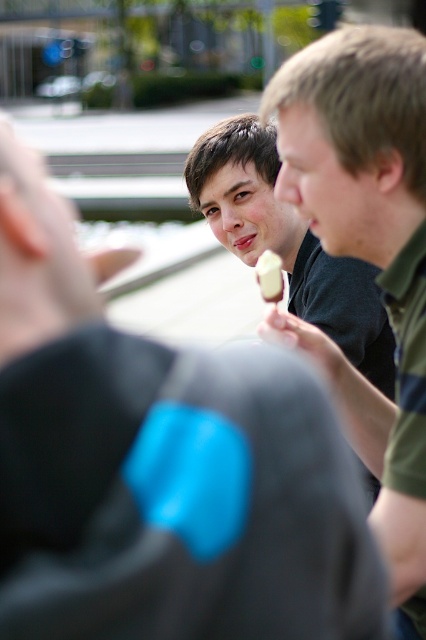
Question: Which point appears closest to the camera in this image?

Choices:
 (A) 268,252
 (B) 382,374

Answer: (A)

Question: Does matte plastic ice cream at center appear on the right side of white creamy ice cream at center?

Choices:
 (A) no
 (B) yes

Answer: (B)

Question: Estimate the real-world distances between objects in this image. Which object is closer to the white creamy ice cream at center?

Choices:
 (A) matte plastic ice cream at center
 (B) matte green shirt at center

Answer: (B)

Question: Is matte green shirt at center thinner than matte plastic ice cream at center?

Choices:
 (A) no
 (B) yes

Answer: (B)

Question: Is matte green shirt at center behind white creamy ice cream at center?

Choices:
 (A) no
 (B) yes

Answer: (A)

Question: Which of these objects is positioned closest to the matte plastic ice cream at center?

Choices:
 (A) matte green shirt at center
 (B) white creamy ice cream at center

Answer: (B)